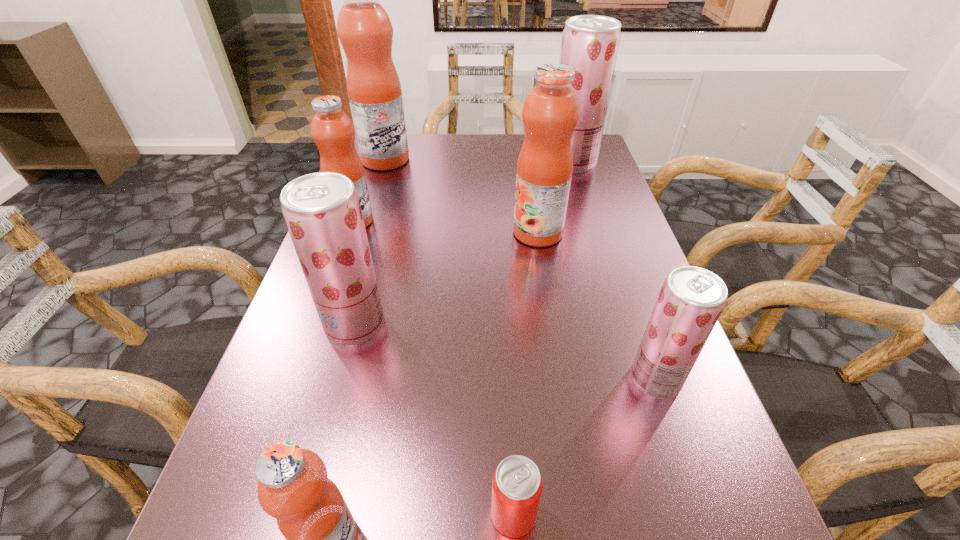
Locate an element on the screen. the biggest orange fruit juice is located at coordinates (365, 31).

At what (x,y) coordinates should I click in order to perform the action: click on the tallest fruit juice. Please return your answer as a coordinate pair (x, y). Looking at the image, I should click on (365, 31).

The width and height of the screenshot is (960, 540). In order to click on the farthest strawberry fruit juice in this screenshot , I will do `click(590, 43)`.

I want to click on the third fruit juice from right to left, so click(x=550, y=113).

I want to click on the third object from right to left, so click(550, 113).

Identify the location of the second smallest strawberry fruit juice. [x=322, y=211].

Find the location of a particular element. This screenshot has width=960, height=540. the leftmost strawberry fruit juice is located at coordinates (322, 211).

You are a GUI agent. You are given a task and a screenshot of the screen. Output one action in this format:
    pyautogui.click(x=<x>, y=<y>)
    Task: Click on the third biggest orange fruit juice
    Image resolution: width=960 pixels, height=540 pixels.
    Given the screenshot: What is the action you would take?
    pyautogui.click(x=332, y=130)

Where is `the nearest strawberry fruit juice`? This screenshot has width=960, height=540. the nearest strawberry fruit juice is located at coordinates (691, 300).

This screenshot has width=960, height=540. Find the location of `the smallest strawberry fruit juice`. the smallest strawberry fruit juice is located at coordinates (691, 300).